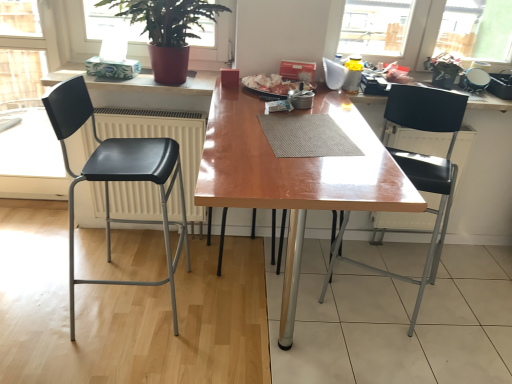
You are a GUI agent. You are given a task and a screenshot of the screen. Output one action in this format:
    pyautogui.click(x=<x>, y=<y>)
    Task: Click on the vacant space positioned to the left of wooden table at center
    Image resolution: width=512 pixels, height=384 pixels.
    Given the screenshot: What is the action you would take?
    pyautogui.click(x=110, y=301)